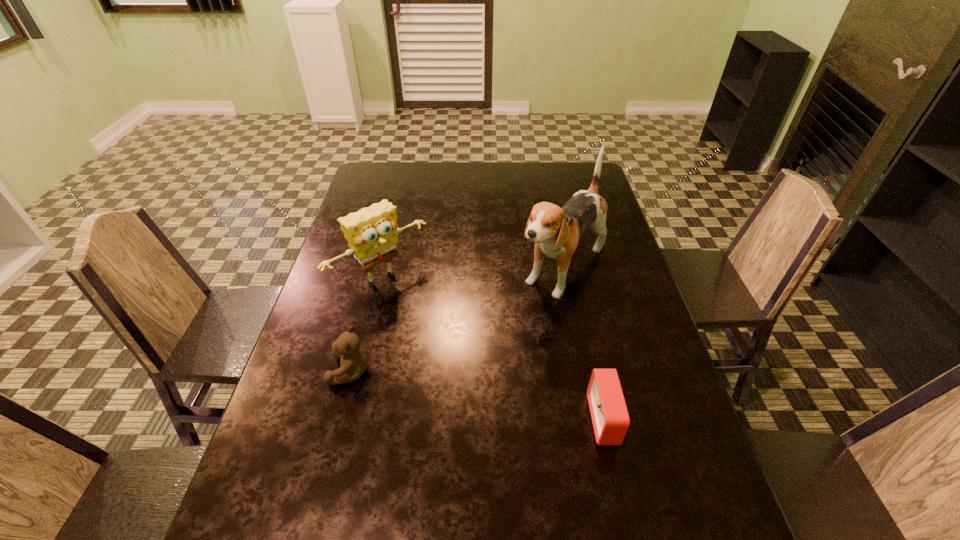
At what (x,y) coordinates should I click in order to perform the action: click on teddy bear. Please return your answer as a coordinate pair (x, y). The width and height of the screenshot is (960, 540). Looking at the image, I should click on (353, 362).

At what (x,y) coordinates should I click in order to perform the action: click on the third farthest object. Please return your answer as a coordinate pair (x, y). The height and width of the screenshot is (540, 960). Looking at the image, I should click on (353, 362).

At what (x,y) coordinates should I click in order to perform the action: click on the shortest object. Please return your answer as a coordinate pair (x, y). The width and height of the screenshot is (960, 540). Looking at the image, I should click on (609, 414).

Locate an element on the screen. The image size is (960, 540). the nearest object is located at coordinates (609, 414).

Locate an element on the screen. This screenshot has width=960, height=540. the tallest object is located at coordinates (556, 231).

Locate an element on the screen. This screenshot has height=540, width=960. the third shortest object is located at coordinates (371, 232).

This screenshot has height=540, width=960. Identify the location of free space located on the front-facing side of the third farthest object. (294, 370).

Identify the location of free space located on the front-facing side of the alarm clock. Image resolution: width=960 pixels, height=540 pixels. (440, 420).

Where is `vacant space located 0.390m on the front-facing side of the alarm clock`? vacant space located 0.390m on the front-facing side of the alarm clock is located at coordinates (412, 420).

In order to click on vacant space located 0.160m on the front-facing side of the alarm clock in this screenshot , I will do [x=517, y=420].